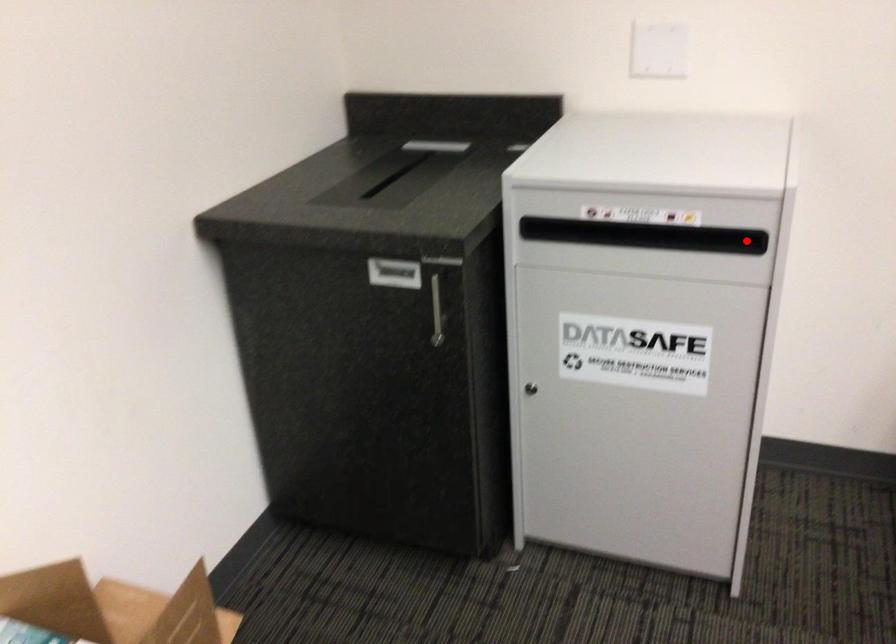
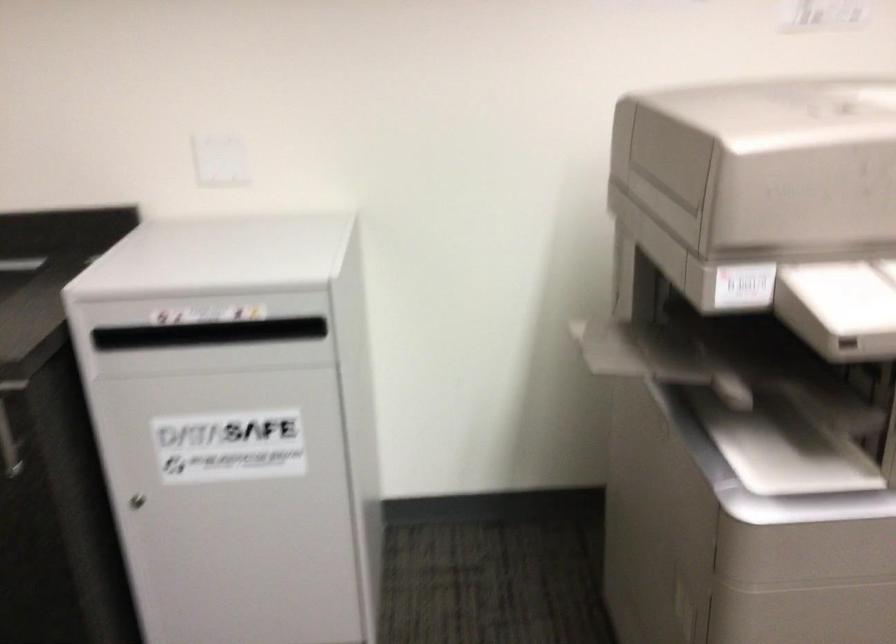
Question: I am providing you with two images of the same scene from different viewpoints. A red point is marked on the first image. Is the red point's position out of view in image 2?

Choices:
 (A) Yes
 (B) No

Answer: (A)